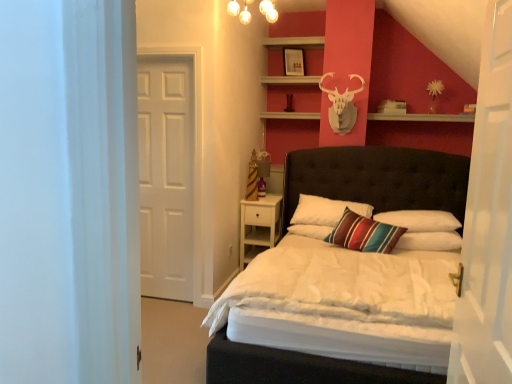
Describe the element at coordinates (259, 226) in the screenshot. I see `white wood nightstand at center` at that location.

What do you see at coordinates (325, 210) in the screenshot? The width and height of the screenshot is (512, 384). I see `striped fabric pillow at center, which is the third pillow in right-to-left order` at bounding box center [325, 210].

Locate an element on the screen. Image resolution: width=512 pixels, height=384 pixels. white soft pillow at center, the 2th pillow positioned from the right is located at coordinates tap(420, 220).

Image resolution: width=512 pixels, height=384 pixels. What do you see at coordinates (420, 220) in the screenshot? I see `white soft pillow at center, the 2th pillow positioned from the right` at bounding box center [420, 220].

Describe the element at coordinates (379, 177) in the screenshot. Image resolution: width=512 pixels, height=384 pixels. I see `tufted leather bed at center` at that location.

Identify the location of white wood nightstand at center. (259, 226).

From the image's perspective, does white wood nightstand at center appear lower than striped fabric pillow at center, acting as the first pillow starting from the left?

Answer: Correct, white wood nightstand at center appears lower than striped fabric pillow at center, acting as the first pillow starting from the left, in the image.

Between white wood nightstand at center and striped fabric pillow at center, acting as the first pillow starting from the left, which one appears on the left side from the viewer's perspective?

white wood nightstand at center is more to the left.

Is striped fabric pillow at center, acting as the first pillow starting from the left, inside white wood nightstand at center?

That's incorrect, striped fabric pillow at center, acting as the first pillow starting from the left, is not inside white wood nightstand at center.

From a real-world perspective, is white wood nightstand at center located higher than striped fabric pillow at center, acting as the first pillow starting from the left?

No, from a real-world perspective, white wood nightstand at center is not on top of striped fabric pillow at center, acting as the first pillow starting from the left.

What's the angular difference between tufted leather bed at center and white wooden door at right, positioned as the first door in right-to-left order,'s facing directions?

89.8 degrees separate the facing orientations of tufted leather bed at center and white wooden door at right, positioned as the first door in right-to-left order.

Is tufted leather bed at center positioned with its back to white wooden door at right, which appears as the second door when viewed from the back?

tufted leather bed at center does not have its back to white wooden door at right, which appears as the second door when viewed from the back.

From a real-world perspective, relative to white wooden door at right, which appears as the second door when viewed from the back, is tufted leather bed at center vertically above or below?

tufted leather bed at center is below white wooden door at right, which appears as the second door when viewed from the back.

Choose the correct answer: Is matte white picture frame at upper center inside white soft pillow at center, the 1th pillow positioned from the right, or outside it?

matte white picture frame at upper center is located beyond the bounds of white soft pillow at center, the 1th pillow positioned from the right.

Is matte white picture frame at upper center positioned behind white soft pillow at center, the 1th pillow positioned from the right?

That is True.

Is matte white picture frame at upper center turned away from white soft pillow at center, the 1th pillow positioned from the right?

matte white picture frame at upper center does not have its back to white soft pillow at center, the 1th pillow positioned from the right.

Which of these two, matte glass chandelier at upper center or white wooden door at right, the second door when ordered from left to right, is smaller?

With smaller size is matte glass chandelier at upper center.

From the image's perspective, is matte glass chandelier at upper center on white wooden door at right, which appears as the first door when viewed from the front?

Yes, from the image's perspective, matte glass chandelier at upper center is on top of white wooden door at right, which appears as the first door when viewed from the front.

Is matte glass chandelier at upper center wider or thinner than white wooden door at right, which appears as the first door when viewed from the front?

Clearly, matte glass chandelier at upper center has more width compared to white wooden door at right, which appears as the first door when viewed from the front.

In the scene shown: Can you tell me how much white soft pillow at center, which appears as the second pillow when viewed from the left, and tufted leather bed at center differ in facing direction?

white soft pillow at center, which appears as the second pillow when viewed from the left, and tufted leather bed at center are facing 3.51 degrees away from each other.

Is white soft pillow at center, the 2th pillow positioned from the right, closer to the viewer compared to tufted leather bed at center?

No, white soft pillow at center, the 2th pillow positioned from the right, is further to the viewer.

Could tufted leather bed at center be considered to be inside white soft pillow at center, the 2th pillow positioned from the right?

No, tufted leather bed at center is not inside white soft pillow at center, the 2th pillow positioned from the right.

Locate an element on the screen. the 1st pillow to the right when counting from the tufted leather bed at center is located at coordinates (420, 220).

Which is in front, point (239, 6) or point (367, 372)?

The point (367, 372) is in front.

Is matte glass chandelier at upper center not near tufted leather bed at center?

matte glass chandelier at upper center is far away from tufted leather bed at center.

From the picture: Can you confirm if matte glass chandelier at upper center is smaller than tufted leather bed at center?

Correct, matte glass chandelier at upper center occupies less space than tufted leather bed at center.

Considering the positions of point (451, 227) and point (291, 59), is point (451, 227) closer or farther from the camera than point (291, 59)?

Point (451, 227) is closer to the camera than point (291, 59).

How different are the orientations of white soft pillow at center, which appears as the second pillow when viewed from the left, and matte white picture frame at upper center in degrees?

They differ by 33.6 degrees in their facing directions.

Consider the image. From the image's perspective, is white soft pillow at center, which appears as the second pillow when viewed from the left, positioned above or below matte white picture frame at upper center?

From the image's perspective, white soft pillow at center, which appears as the second pillow when viewed from the left, appears below matte white picture frame at upper center.

In terms of width, does white soft pillow at center, the 2th pillow positioned from the right, look wider or thinner when compared to matte white picture frame at upper center?

Clearly, white soft pillow at center, the 2th pillow positioned from the right, has more width compared to matte white picture frame at upper center.

The image size is (512, 384). Identify the location of nightstand behind the striped fabric pillow at center, acting as the first pillow starting from the left. (259, 226).

What are the coordinates of `door lying in front of the tufted leather bed at center` in the screenshot? It's located at (488, 219).

Considering their positions, is white soft pillow at center, the 1th pillow positioned from the right, positioned further to tufted leather bed at center than white soft pillow at center, which appears as the second pillow when viewed from the left?

white soft pillow at center, the 1th pillow positioned from the right, lies further to tufted leather bed at center than the other object.

Looking at the image, which one is located further to white wooden door at right, the second door when ordered from left to right, matte glass chandelier at upper center or tufted leather bed at center?

Based on the image, matte glass chandelier at upper center appears to be further to white wooden door at right, the second door when ordered from left to right.

Looking at the image, which one is located closer to white soft pillow at center, marked as the third pillow in a left-to-right arrangement, matte glass chandelier at upper center or tufted leather bed at center?

The object closer to white soft pillow at center, marked as the third pillow in a left-to-right arrangement, is tufted leather bed at center.

In the scene shown: Estimate the real-world distances between objects in this image. Which object is further from white matte door at left, which ranks as the first door in back-to-front order, striped fabric pillow at center, acting as the first pillow starting from the left, or white wooden door at right, the second door when ordered from left to right?

Among the two, white wooden door at right, the second door when ordered from left to right, is located further to white matte door at left, which ranks as the first door in back-to-front order.

Considering their positions, is white wooden door at right, which appears as the second door when viewed from the back, positioned further to tufted leather bed at center than white soft pillow at center, the 2th pillow positioned from the right?

white wooden door at right, which appears as the second door when viewed from the back, lies further to tufted leather bed at center than the other object.

Which object lies nearer to the anchor point white soft pillow at center, the 1th pillow positioned from the right, white wooden door at right, which appears as the second door when viewed from the back, or white wood nightstand at center?

The object closer to white soft pillow at center, the 1th pillow positioned from the right, is white wood nightstand at center.

Considering their positions, is white matte door at left, which appears as the 1th door when viewed from the left, positioned closer to tufted leather bed at center than matte glass chandelier at upper center?

white matte door at left, which appears as the 1th door when viewed from the left, lies closer to tufted leather bed at center than the other object.

When comparing their distances from white wood nightstand at center, does matte white picture frame at upper center or white soft pillow at center, the 2th pillow positioned from the right, seem closer?

The object closer to white wood nightstand at center is white soft pillow at center, the 2th pillow positioned from the right.

Where is `bed between matte glass chandelier at upper center and white soft pillow at center, the 1th pillow positioned from the right, from top to bottom`? This screenshot has width=512, height=384. bed between matte glass chandelier at upper center and white soft pillow at center, the 1th pillow positioned from the right, from top to bottom is located at coordinates (379, 177).

This screenshot has width=512, height=384. I want to click on bed between white wooden door at right, positioned as the first door in right-to-left order, and striped fabric pillow at center, which is the third pillow in right-to-left order, along the z-axis, so click(379, 177).

I want to click on light fixture between tufted leather bed at center and matte white picture frame at upper center from front to back, so click(240, 11).

You are a GUI agent. You are given a task and a screenshot of the screen. Output one action in this format:
    pyautogui.click(x=<x>, y=<y>)
    Task: Click on the picture frame between white matte door at left, which is counted as the second door, starting from the right, and white soft pillow at center, the 2th pillow positioned from the right, in the horizontal direction
    The width and height of the screenshot is (512, 384).
    Given the screenshot: What is the action you would take?
    pyautogui.click(x=293, y=62)